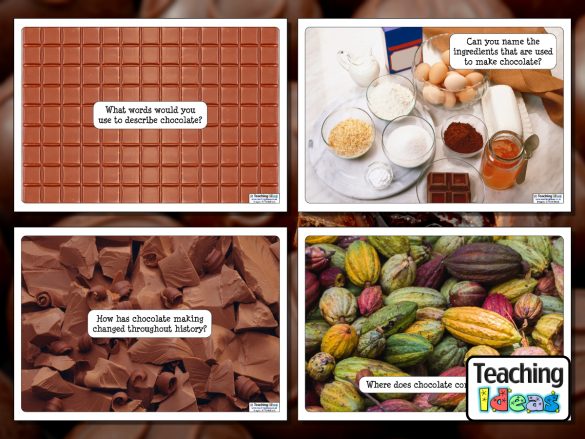
The width and height of the screenshot is (585, 439). In order to click on panels in this screenshot , I will do `click(228, 149)`, `click(340, 153)`, `click(261, 293)`, `click(353, 298)`.